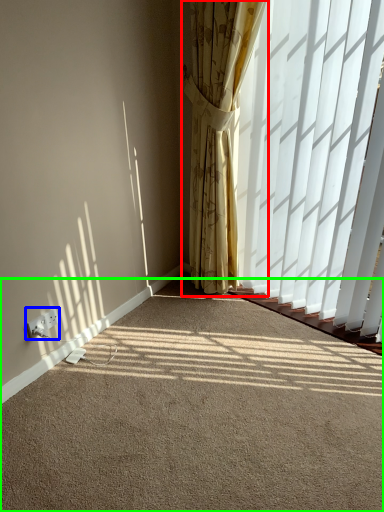
Question: Which object is positioned closest to curtain (highlighted by a red box)? Select from electric outlet (highlighted by a blue box) and plain (highlighted by a green box).

Choices:
 (A) electric outlet
 (B) plain

Answer: (B)